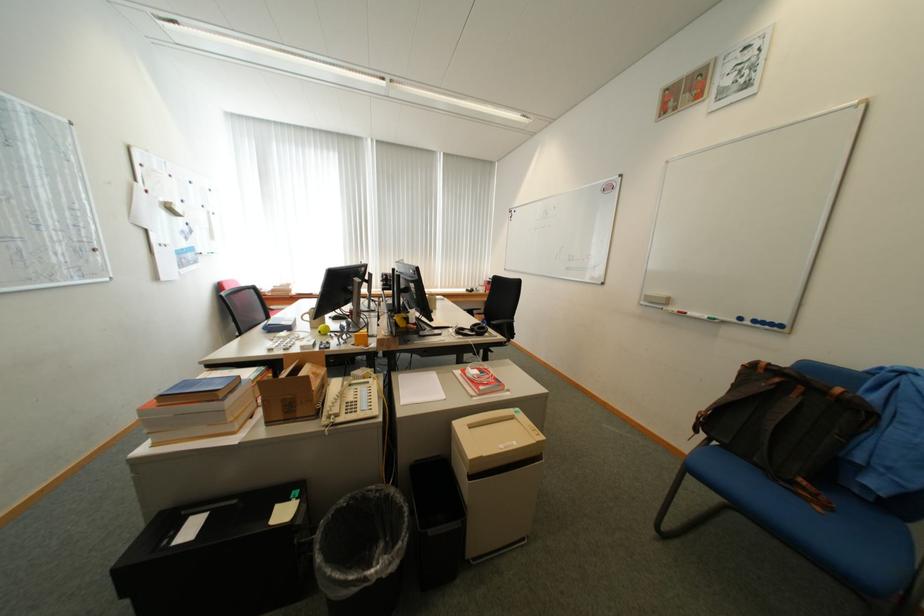
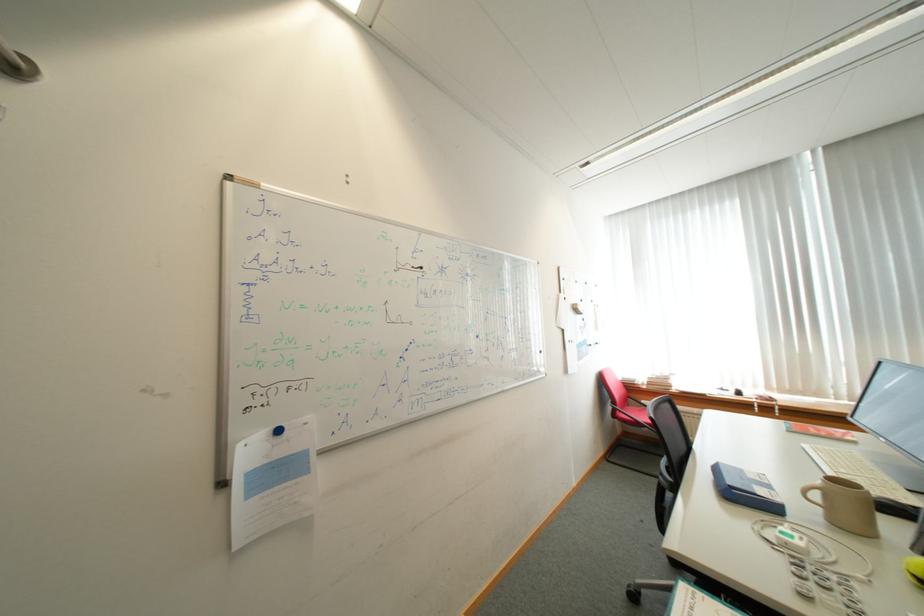
Question: Based on the continuous images, in which direction is the camera rotating? Reply with the corresponding letter.

Choices:
 (A) Left
 (B) Right
 (C) Up
 (D) Down

Answer: (A)